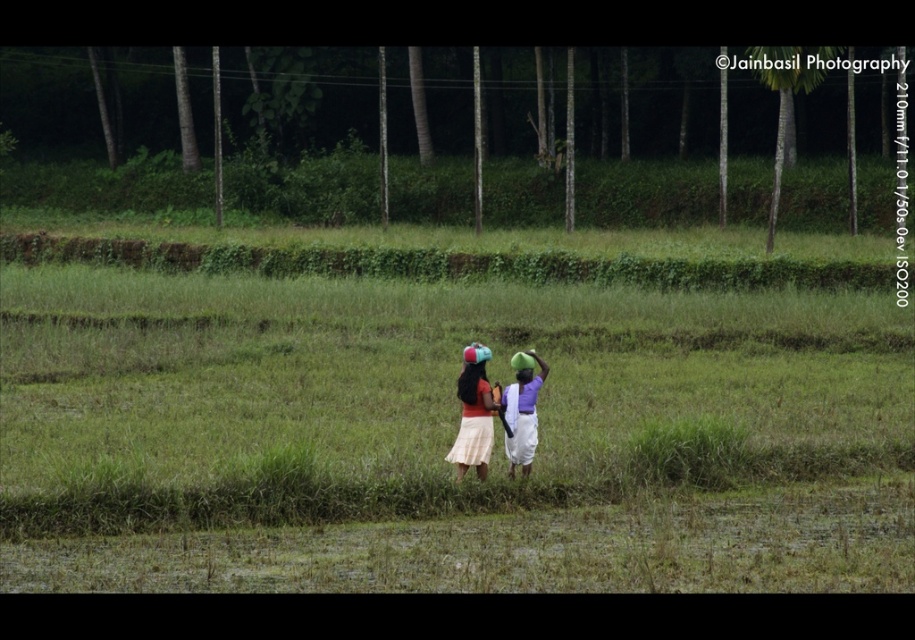
You are a photographer trying to capture a closeup shot of the matte green headscarf at center and the green matte headband at center. Since you want to focus on the headscarf first, which one should you adjust your camera to prioritize focusing on first?

The matte green headscarf at center is closer to the viewer than the green matte headband at center, so you should prioritize focusing on the matte green headscarf at center first.

You are a farmer in the field and need to choose between the matte green headscarf at center and the green matte headband at center to protect yourself from the sun. Which one would provide better sun protection based on their size?

The matte green headscarf at center is larger in size than the green matte headband at center, so it would provide better sun protection.

You are a photographer trying to capture the matte fabric dress at center and the matte green headscarf at center in a single frame. Since the dress is covering the headscarf, which object should you adjust to ensure both are fully visible in the photo?

The matte fabric dress at center is positioned over the matte green headscarf at center. To ensure both are fully visible, you should adjust the position of the matte fabric dress at center so it no longer covers the headscarf.